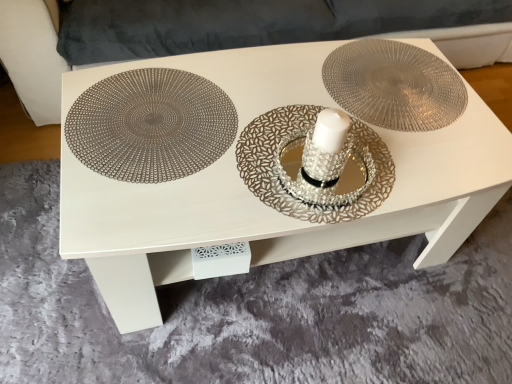
This screenshot has width=512, height=384. I want to click on vacant location behind silver textured plate at center, so click(278, 80).